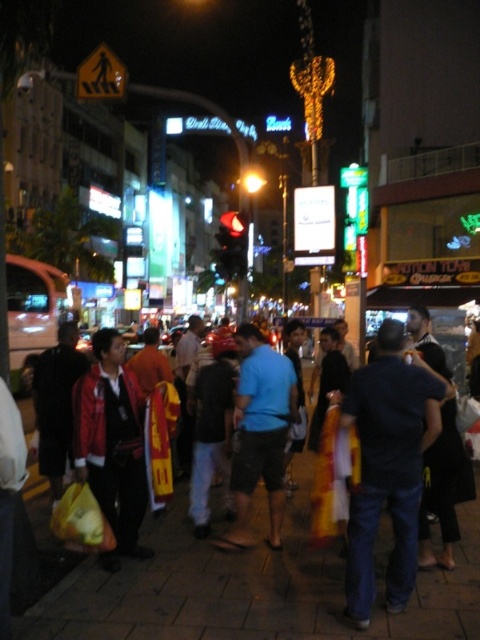
In the scene shown: You are a photographer standing in the middle of the street. You notice the smooth concrete pavement at center and the dark blue jeans at center in your viewfinder. Which object takes up more space in the photo?

The dark blue jeans at center takes up more space in the photo because the smooth concrete pavement at center occupies less space than dark blue jeans at center according to the description.

You are a delivery robot with a 3.5 feet wide package. You need to move along the street while avoiding obstacles. Can you fit between the smooth concrete pavement at center and the dark blue jeans at center?

The smooth concrete pavement at center and dark blue jeans at center are 3.45 feet apart from each other, so no, the robot cannot fit through the space between them since the package is wider than the gap.

You are a tailor who needs to determine which clothing item takes up more horizontal space in the image. Looking at the dark blue jeans at center and the blue cotton shirt at center, which one is wider?

The dark blue jeans at center is wider than the blue cotton shirt at center according to the description.